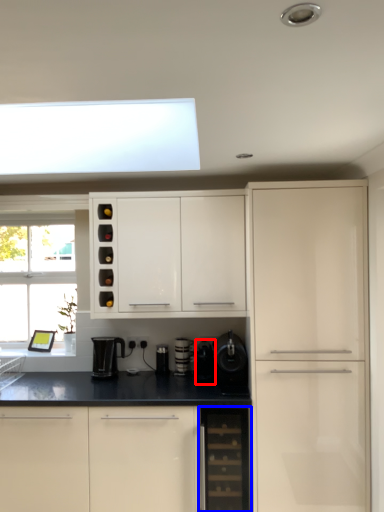
Question: Which point is further to the camera, appliance (highlighted by a red box) or dish washer (highlighted by a blue box)?

Choices:
 (A) appliance
 (B) dish washer

Answer: (A)